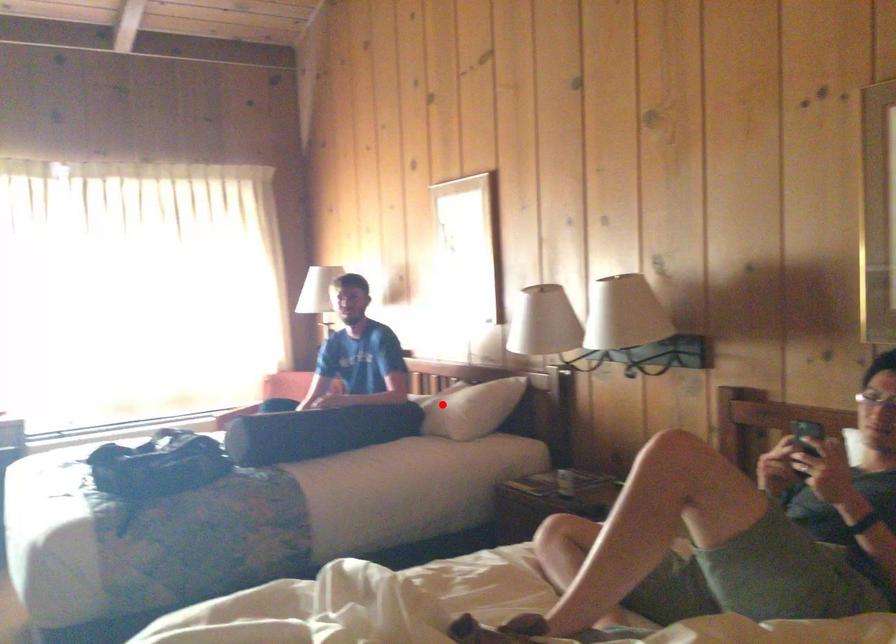
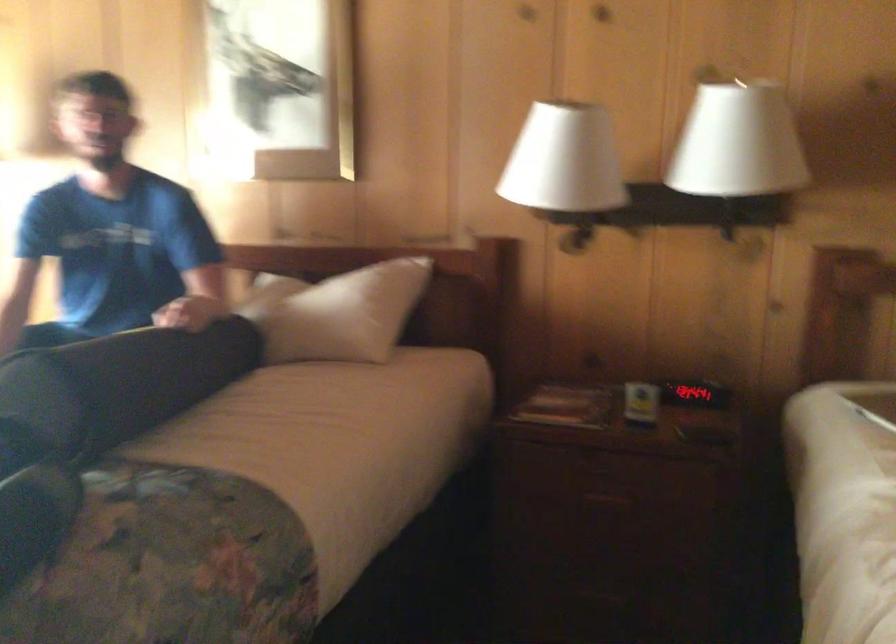
Question: I am providing you with two images of the same scene from different viewpoints. Given a red point in image1, look at the same physical point in image2. Is it:

Choices:
 (A) Closer to the viewpoint
 (B) Farther from the viewpoint

Answer: (A)